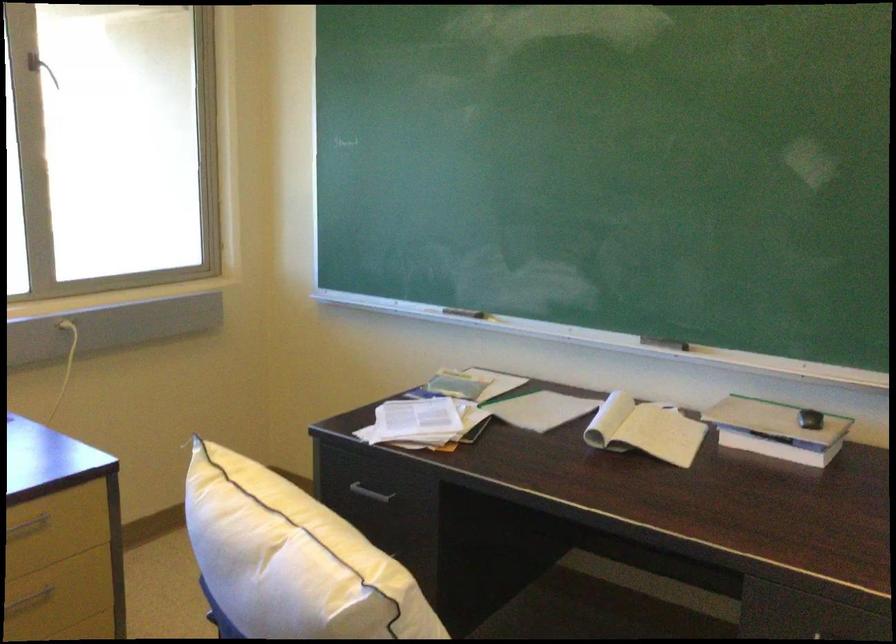
This screenshot has height=644, width=896. What do you see at coordinates (644, 430) in the screenshot?
I see `the open spiral notebook` at bounding box center [644, 430].